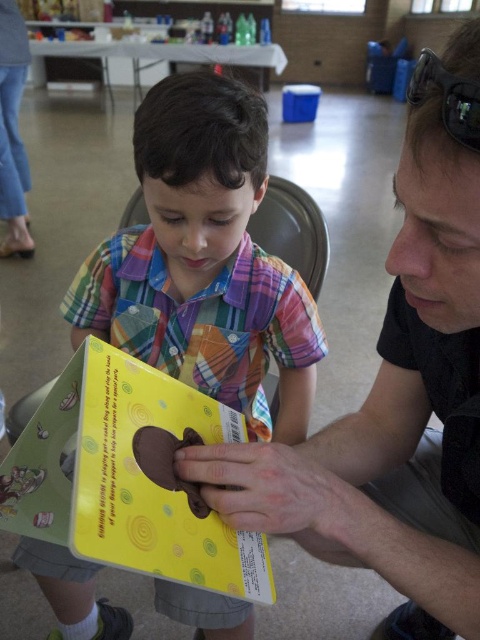
Question: Can you confirm if matte black book at center is positioned below yellow matte book at center?

Choices:
 (A) no
 (B) yes

Answer: (A)

Question: Does matte black book at center have a greater width compared to yellow matte book at center?

Choices:
 (A) yes
 (B) no

Answer: (A)

Question: Which object is positioned closest to the yellow paper book at center?

Choices:
 (A) yellow matte book at center
 (B) black plastic goggles at upper right
 (C) matte black book at center

Answer: (C)

Question: Which point is closer to the camera?

Choices:
 (A) (280, 264)
 (B) (168, 540)
 (C) (420, 92)
 (D) (468, 435)

Answer: (C)

Question: Which point is closer to the camera taking this photo?

Choices:
 (A) (193, 550)
 (B) (459, 465)

Answer: (A)

Question: Can you confirm if matte black book at center is positioned below yellow matte book at center?

Choices:
 (A) yes
 (B) no

Answer: (B)